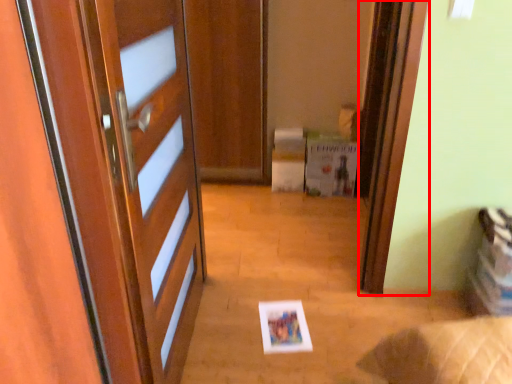
Question: From the image's perspective, where is screen door (annotated by the red box) located in relation to postcard in the image?

Choices:
 (A) above
 (B) below

Answer: (A)